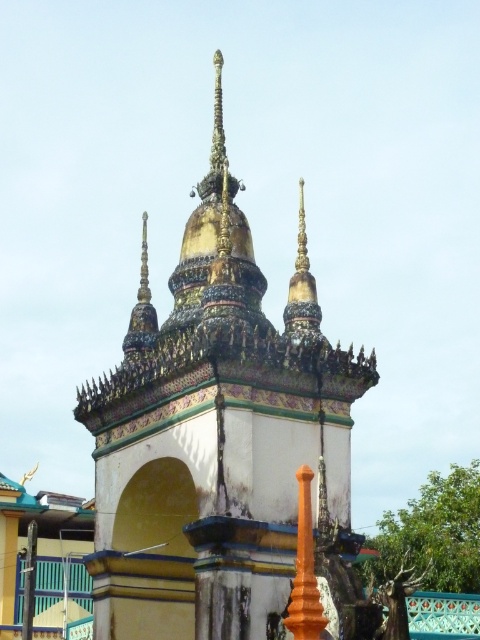
Question: Which point is farther from the camera taking this photo?

Choices:
 (A) (255, 632)
 (B) (286, 621)

Answer: (A)

Question: Which object is closer to the camera taking this photo?

Choices:
 (A) orange polished pillar at center
 (B) gold mosaic temple at center

Answer: (A)

Question: Does gold mosaic temple at center have a lesser width compared to orange polished pillar at center?

Choices:
 (A) no
 (B) yes

Answer: (A)

Question: Can you confirm if gold mosaic temple at center is positioned to the left of orange polished pillar at center?

Choices:
 (A) no
 (B) yes

Answer: (B)

Question: Does gold mosaic temple at center appear on the right side of orange polished pillar at center?

Choices:
 (A) yes
 (B) no

Answer: (B)

Question: Which object appears closest to the camera in this image?

Choices:
 (A) gold mosaic temple at center
 (B) orange polished pillar at center

Answer: (B)